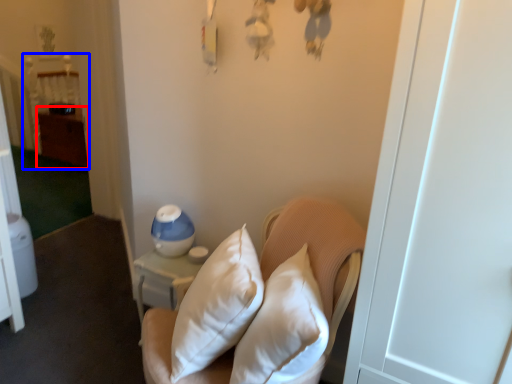
Question: Among these objects, which one is nearest to the camera, dresser (highlighted by a red box) or bed (highlighted by a blue box)?

Choices:
 (A) dresser
 (B) bed

Answer: (A)